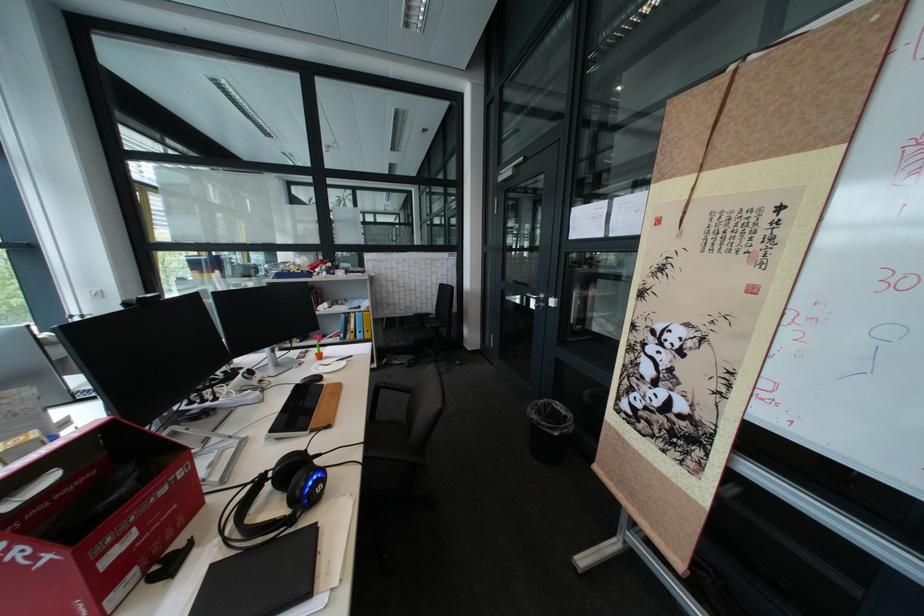
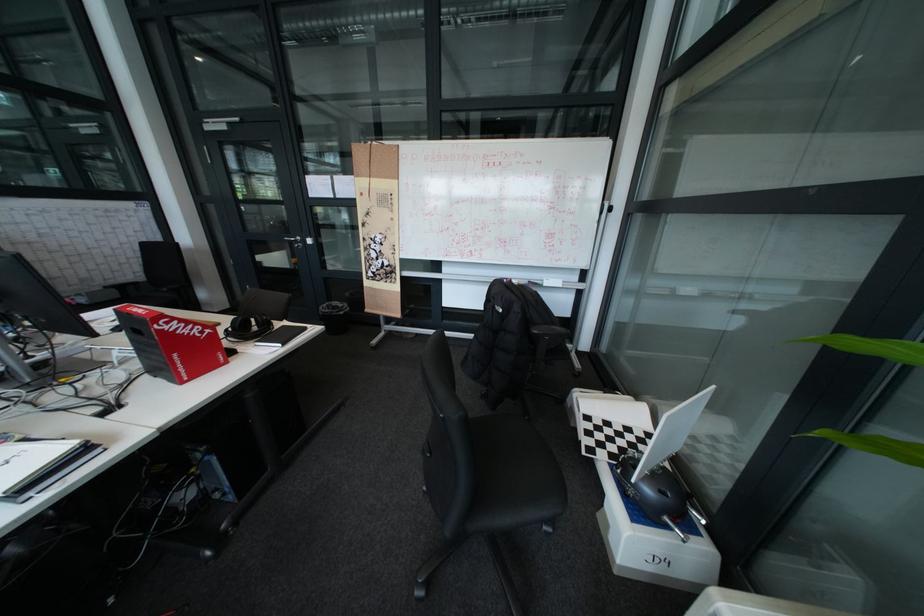
Find the pixel in the second image that matches point (541, 294) in the first image.

(299, 238)